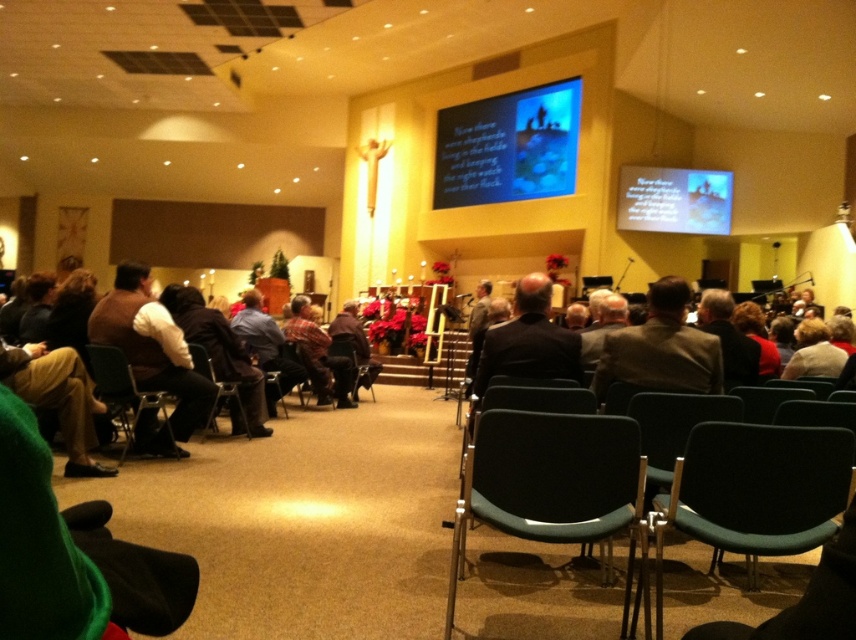
You are standing at point (242,376) and want to walk to the front of the church. There is a point at (699,456). Which direction should you move relative to that point?

You should move forward towards the front of the church since point (699,456) is in front of point (242,376).

You are trying to decide whether to place a rectangular box on the green plastic chair at lower left or the plaid shirt at center. Based on their widths, which object can the box fit on?

Result: The green plastic chair at lower left is thinner than the plaid shirt at center, so the box would fit better on the plaid shirt at center since it has a wider surface area.

You are a person who is 5 feet tall and standing at the entrance of the church. You want to walk from your current position to the brown sweater at left and then to the matte black chair at center. Can you comfortably walk through the space between them without feeling cramped?

The distance between the brown sweater at left and the matte black chair at center is 8.39 feet. Since you are 5 feet tall, this distance is sufficient for comfortable movement. You can easily walk through the space without feeling cramped.